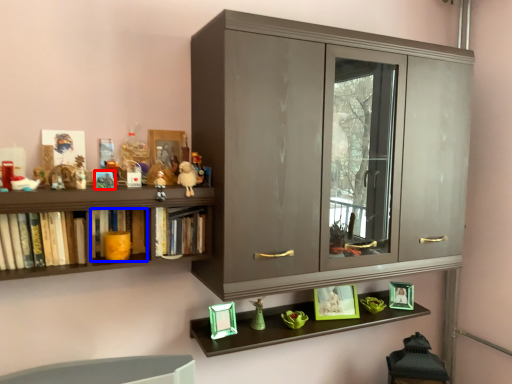
Question: Which of the following is the closest to the observer, toy (highlighted by a red box) or book (highlighted by a blue box)?

Choices:
 (A) toy
 (B) book

Answer: (A)